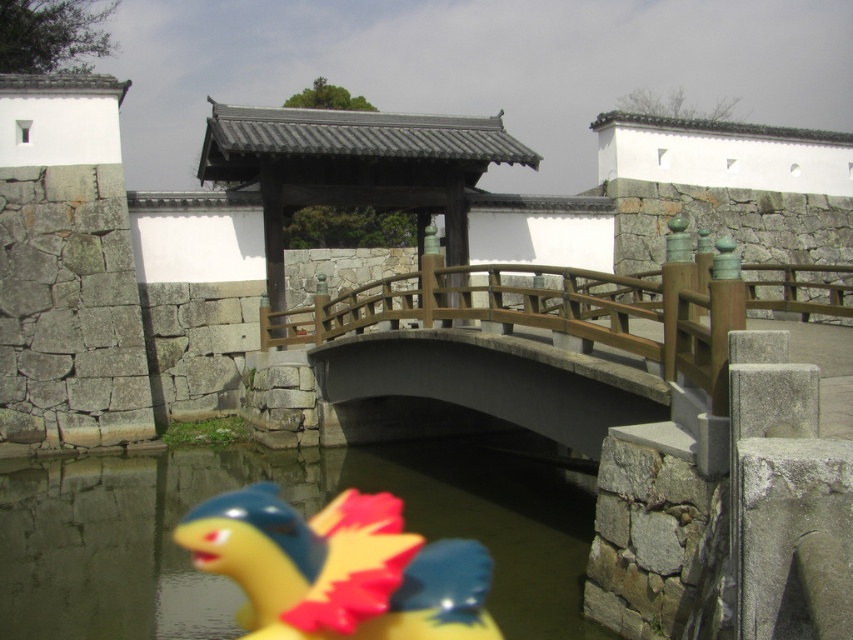
You are a visitor at this historical site and want to take a photo of both the transparent plastic water at lower center and the wooden bridge at center. Since you want to include both in the frame, which object should you focus on to ensure both are visible?

You should focus on the wooden bridge at center because it is larger than the transparent plastic water at lower center, making it easier to frame both objects in the photo.